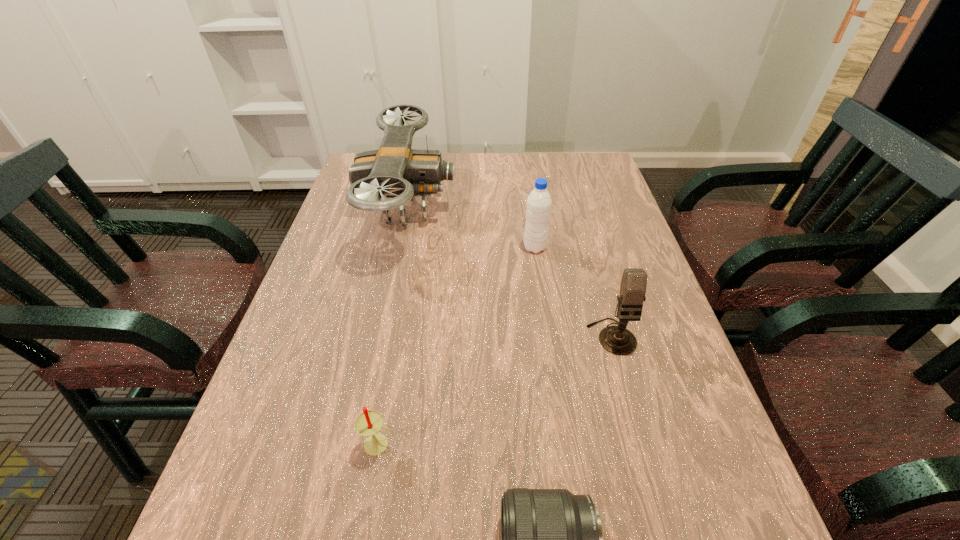
The width and height of the screenshot is (960, 540). Find the location of `vacant point located between the water bottle and the third farthest object`. vacant point located between the water bottle and the third farthest object is located at coordinates (573, 292).

Find the location of `vacant area between the candle and the drone`. vacant area between the candle and the drone is located at coordinates (394, 327).

Identify the location of the closest object to the rightmost object. (538, 208).

Locate which object is the third closest to the water bottle. Please provide its 2D coordinates. Your answer should be formatted as a tuple, i.e. [(x, y)], where the tuple contains the x and y coordinates of a point satisfying the conditions above.

[(368, 423)]

Where is `vacant point that satisfies the following two spatial constraints: 1. on the back side of the water bottle; 2. on the front-facing side of the drone`? This screenshot has width=960, height=540. vacant point that satisfies the following two spatial constraints: 1. on the back side of the water bottle; 2. on the front-facing side of the drone is located at coordinates (529, 211).

Locate an element on the screen. free space that satisfies the following two spatial constraints: 1. on the front-facing side of the drone; 2. on the right side of the candle is located at coordinates (360, 444).

The height and width of the screenshot is (540, 960). I want to click on blank space that satisfies the following two spatial constraints: 1. on the back side of the fourth farthest object; 2. on the front-facing side of the drone, so click(x=420, y=211).